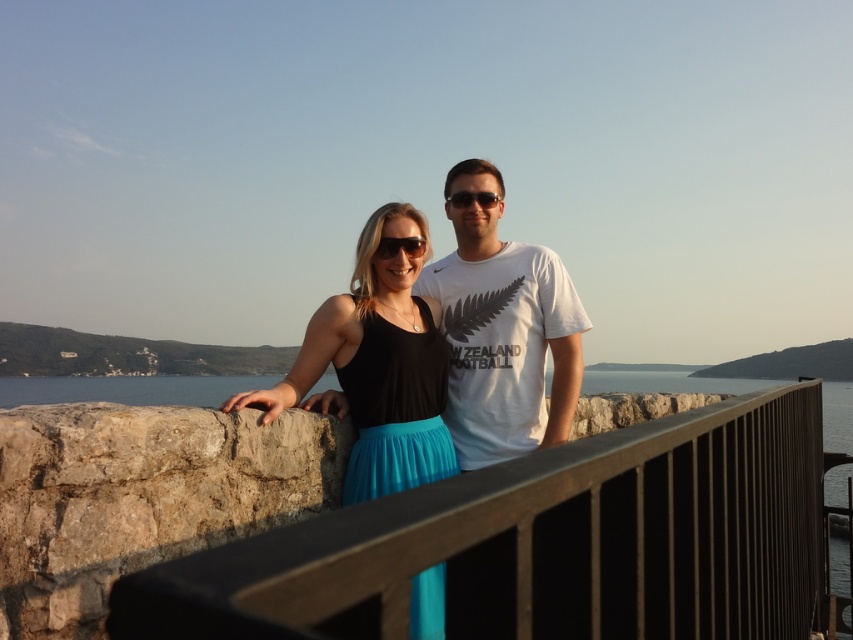
What is the color of the clothing item at the point with coordinates (376,365)?

The point at coordinates (376,365) is on the black matte tank top at center, so the color is black.

You are standing at the point marked by the coordinates point (543, 545). Based on the scene description, what object is located at this coordinate?

The point (543, 545) indicates a brown wooden rail at center.